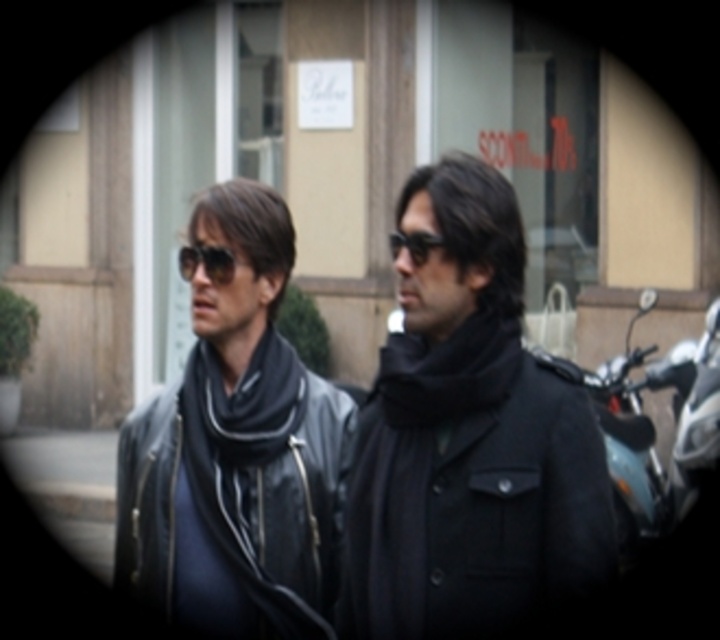
You are a photographer trying to capture a closeup shot of the black soft scarf at left and the matte black sunglasses at center. Which object should you focus on first if you want to ensure both are in focus, considering their positions?

The black soft scarf at left is below matte black sunglasses at center, so you should focus on the matte black sunglasses at center first to ensure both are in focus.